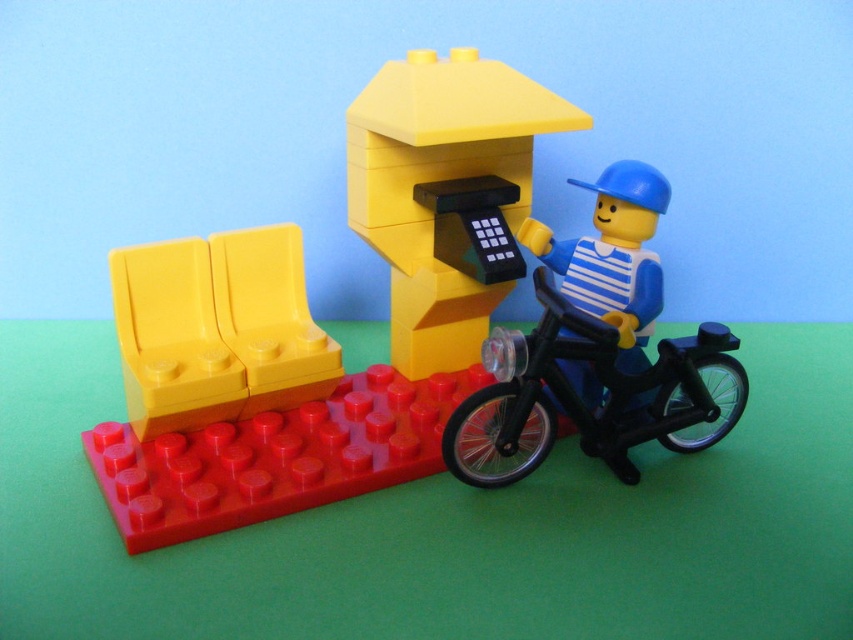
You are a LEGO minifigure trying to reach the black plastic monocycle at lower right from the yellow matte bench at left. Which direction should you walk to get there?

You should walk to the right because the black plastic monocycle at lower right is located to the right of the yellow matte bench at left.

You are a delivery person trying to deliver a package to the matte black telephone booth at center. You see the blue matte construction worker at right nearby. Which object is higher in elevation between the two?

The matte black telephone booth at center is above the blue matte construction worker at right, so the telephone booth is higher in elevation.